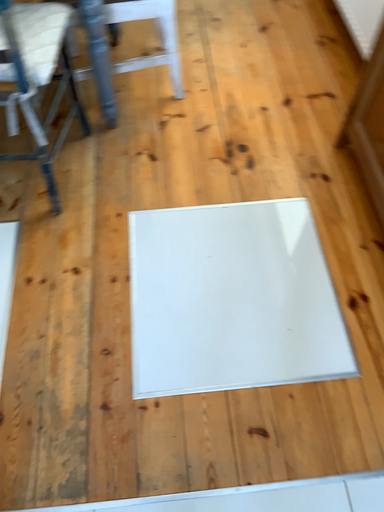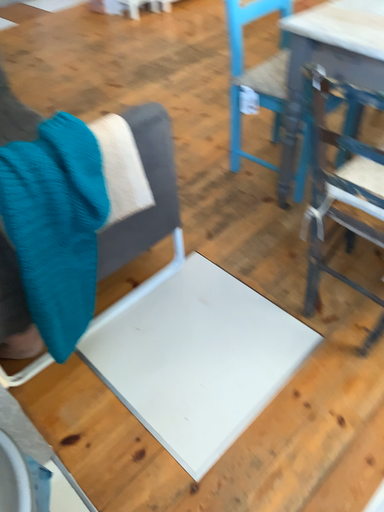
Question: How did the camera likely rotate when shooting the video?

Choices:
 (A) rotated downward
 (B) rotated upward

Answer: (B)